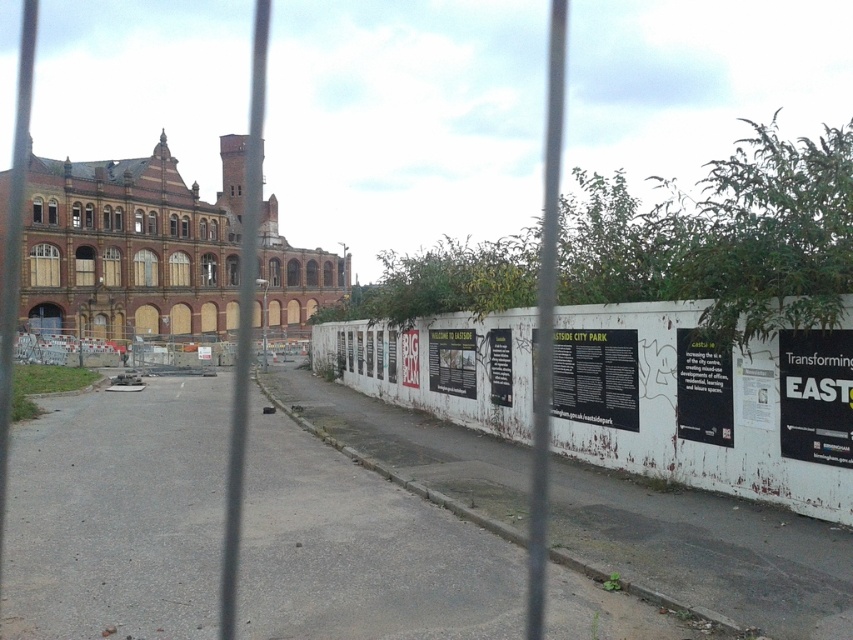
Is black paper at right below green paper poster at center?

Incorrect, black paper at right is not positioned below green paper poster at center.

Is the position of black paper at right less distant than that of green paper poster at center?

Yes, it is.

Which is in front, point (828, 460) or point (712, 369)?

Point (828, 460) is in front.

You are a GUI agent. You are given a task and a screenshot of the screen. Output one action in this format:
    pyautogui.click(x=<x>, y=<y>)
    Task: Click on the black paper at right
    This screenshot has width=853, height=640.
    Given the screenshot: What is the action you would take?
    pyautogui.click(x=815, y=396)

Is green paper poster at center bigger than white paper poster at center?

Actually, green paper poster at center might be smaller than white paper poster at center.

Where is `green paper poster at center`? green paper poster at center is located at coordinates (703, 388).

Where is `green paper poster at center`? This screenshot has width=853, height=640. green paper poster at center is located at coordinates (703, 388).

Who is higher up, black paper at right or white paper poster at center?

black paper at right

I want to click on black paper at right, so click(x=815, y=396).